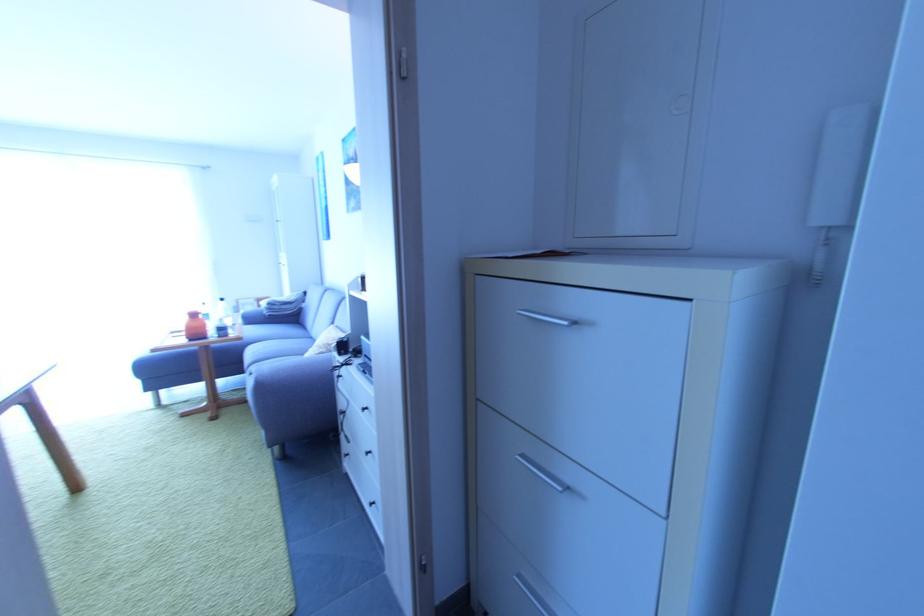
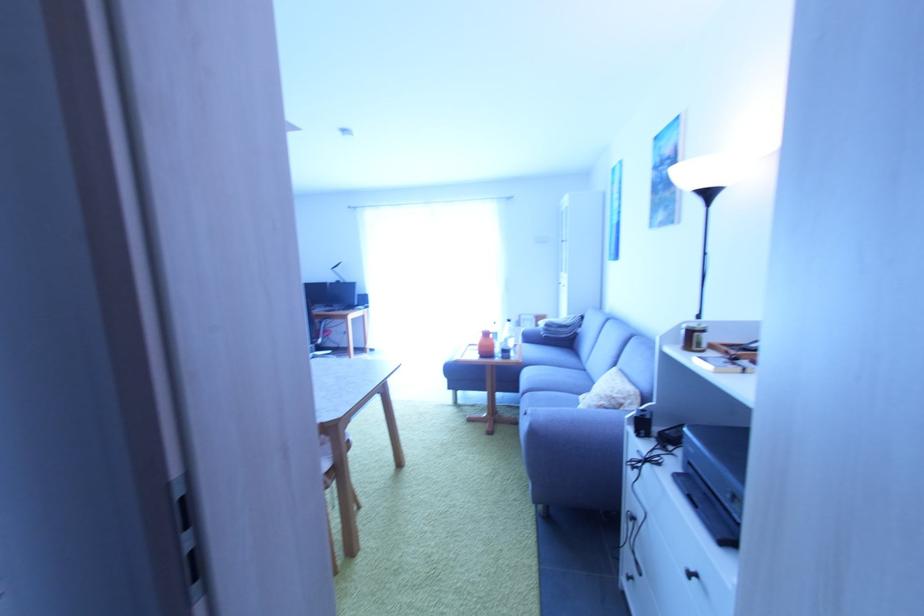
Question: Based on the continuous images, in which direction is the camera rotating? Reply with the corresponding letter.

Choices:
 (A) Left
 (B) Right
 (C) Up
 (D) Down

Answer: (A)